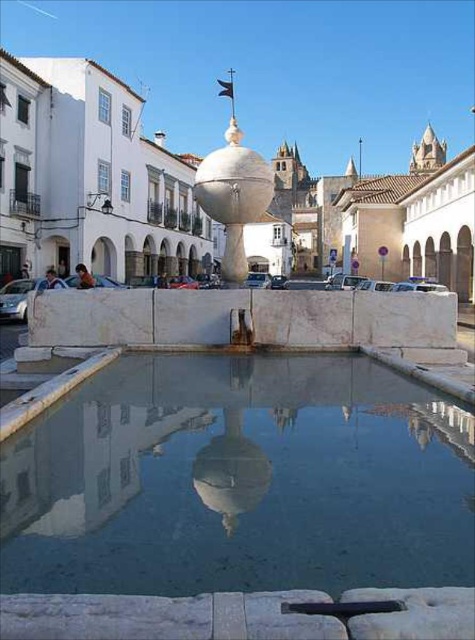
You are standing in the urban square and want to walk from the point at coordinates point (178, 529) to the point at coordinates point (224, 189). Based on the scene description, which direction should you move relative to the fountain?

Since point (178, 529) is in front of point (224, 189), you should move towards the fountain to reach point (224, 189) from point (178, 529).

You are a tourist standing at the edge of the urban square. You want to take a photo of the white marble sphere at center and the clear glass water at center in the same frame. The camera you have can capture objects within a 20 meter range. Will both objects fit in the frame?

The clear glass water at center is 19.53 meters from the white marble sphere at center. Since the distance between them is less than 20 meters, both objects will fit in the camera frame.

You are standing at the camera position looking at the urban square. There is a point marked at coordinates point (123, 580). Can you estimate how far this point is from your current position?

The point (123, 580) is 56.71 feet away from the camera position.